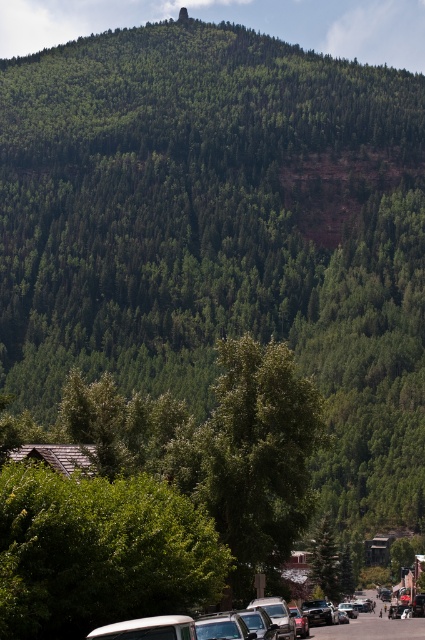
Does green leafy tree at lower center have a lesser height compared to shiny silver sedan at lower center?

Indeed, green leafy tree at lower center has a lesser height compared to shiny silver sedan at lower center.

Between point (118, 576) and point (308, 625), which one is positioned in front?

Point (118, 576) is more forward.

At what (x,y) coordinates should I click in order to perform the action: click on green leafy tree at lower center. Please return your answer as a coordinate pair (x, y). Looking at the image, I should click on (99, 552).

Image resolution: width=425 pixels, height=640 pixels. I want to click on green leafy tree at lower center, so click(99, 552).